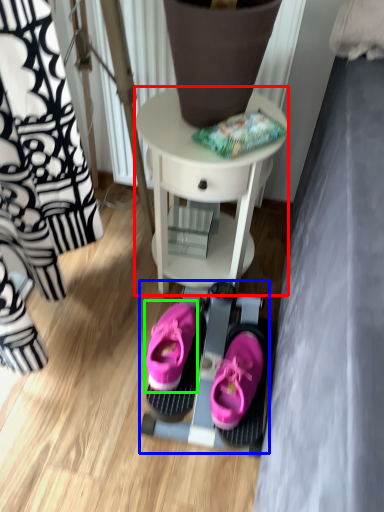
Question: Which object is the closest to the table (highlighted by a red box)? Choose among these: bunk bed (highlighted by a blue box) or footwear (highlighted by a green box).

Choices:
 (A) bunk bed
 (B) footwear

Answer: (A)